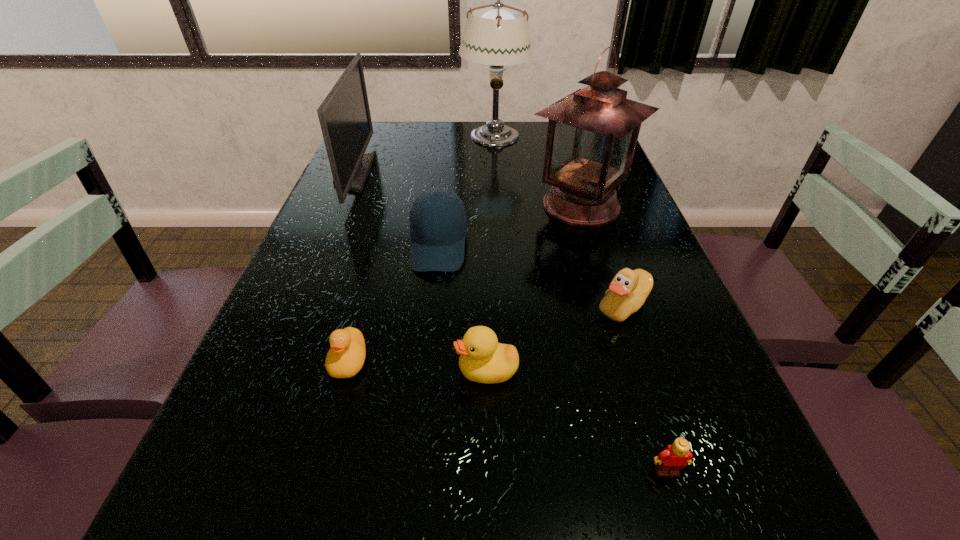
This screenshot has width=960, height=540. In order to click on free space between the lampshade and the baseball cap in this screenshot , I will do `click(466, 191)`.

You are a GUI agent. You are given a task and a screenshot of the screen. Output one action in this format:
    pyautogui.click(x=<x>, y=<y>)
    Task: Click on the empty space between the baseball cap and the Lego
    
    Given the screenshot: What is the action you would take?
    pyautogui.click(x=553, y=359)

Where is `the second closest object to the baseball cap`? This screenshot has height=540, width=960. the second closest object to the baseball cap is located at coordinates (344, 115).

Select which object appears as the second closest to the leftmost duck. Please provide its 2D coordinates. Your answer should be formatted as a tuple, i.e. [(x, y)], where the tuple contains the x and y coordinates of a point satisfying the conditions above.

[(438, 226)]

Choose which duck is the second nearest neighbor to the second duck from left to right. Please provide its 2D coordinates. Your answer should be formatted as a tuple, i.e. [(x, y)], where the tuple contains the x and y coordinates of a point satisfying the conditions above.

[(629, 289)]

This screenshot has width=960, height=540. Identify the location of duck that stands as the second closest to the shortest duck. (629, 289).

This screenshot has height=540, width=960. I want to click on vacant region that satisfies the following two spatial constraints: 1. on the front side of the oil lamp; 2. at the beak of the second duck from left to right, so click(x=633, y=370).

You are a GUI agent. You are given a task and a screenshot of the screen. Output one action in this format:
    pyautogui.click(x=<x>, y=<y>)
    Task: Click on the vacant region that satisfies the following two spatial constraints: 1. on the lampshade of the lampshade; 2. at the beak of the second duck from right to left
    This screenshot has height=540, width=960.
    Given the screenshot: What is the action you would take?
    pyautogui.click(x=506, y=370)

I want to click on free spot that satisfies the following two spatial constraints: 1. on the lampshade of the oil lamp; 2. on the right side of the lampshade, so click(497, 206).

At what (x,y) coordinates should I click in order to perform the action: click on vacant space that satisfies the following two spatial constraints: 1. on the lampshade of the lampshade; 2. at the beak of the second duck from right to left. Please return your answer as a coordinate pair (x, y). Looking at the image, I should click on (506, 370).